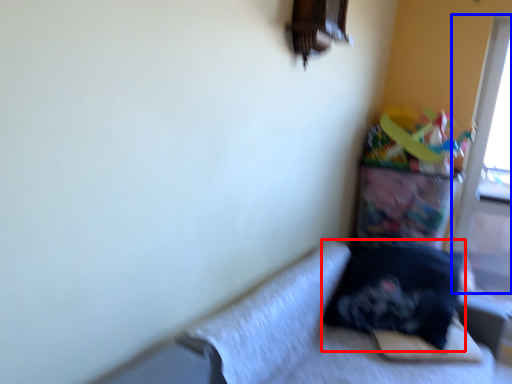
Question: Which of the following is the closest to the observer, pillow (highlighted by a red box) or screen door (highlighted by a blue box)?

Choices:
 (A) pillow
 (B) screen door

Answer: (A)